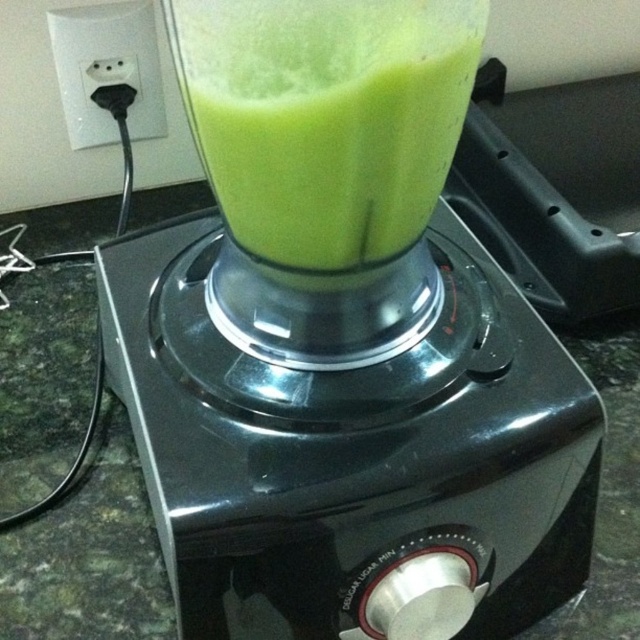
Question: Which of the following is the closest to the observer?

Choices:
 (A) green matte liquid at center
 (B) black plastic plug at upper left

Answer: (A)

Question: Which of the following is the closest to the observer?

Choices:
 (A) black plastic plug at upper left
 (B) green matte liquid at center

Answer: (B)

Question: Is green matte liquid at center above black plastic plug at upper left?

Choices:
 (A) no
 (B) yes

Answer: (A)

Question: Among these objects, which one is nearest to the camera?

Choices:
 (A) green matte liquid at center
 (B) black plastic plug at upper left

Answer: (A)

Question: Does green matte liquid at center lie behind black plastic plug at upper left?

Choices:
 (A) no
 (B) yes

Answer: (A)

Question: Does green matte liquid at center appear over black plastic plug at upper left?

Choices:
 (A) no
 (B) yes

Answer: (A)